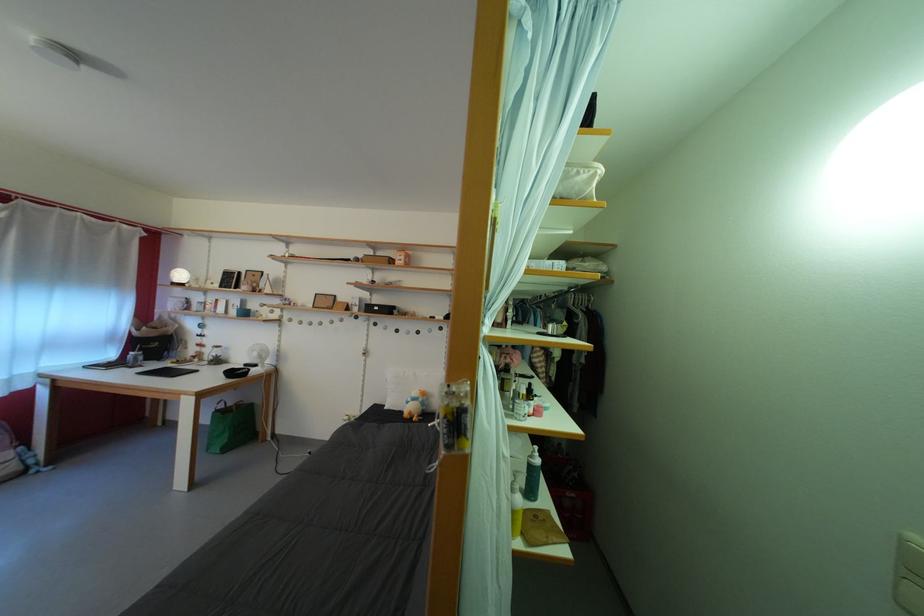
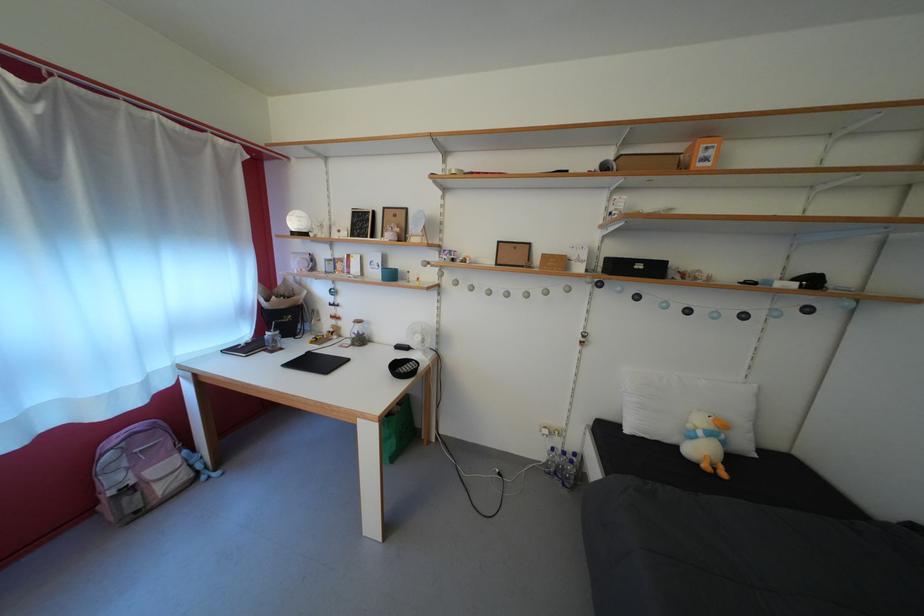
The point at (x=242, y=318) is marked in the first image. Where is the corresponding point in the second image?

(383, 280)